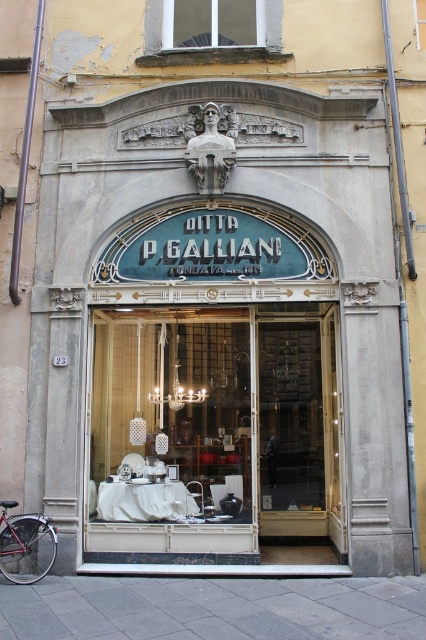
You are a delivery person arriving at the shop entrance. You need to locate the matte glass door at center to deliver a package. Based on the scene description, where should you look relative to the shiny red bicycle at lower left?

The matte glass door at center is to the right of the shiny red bicycle at lower left, so you should look to the right side of the shiny red bicycle at lower left to find the door.

You are standing at the entrance of P. Galliani shop and want to reach the two points marked on the shop facade. Which point, point [187,32] or point [2,531], is closer to you?

Point [187,32] is closer to you because it is further to the viewer than point [2,531].

Based on the photo, you are standing at the point labeled point (181, 3). You want to move to the other point, which is 12.18 meters away. Is there enough space for you to walk straight to that point without any obstacles?

The two points are 12.18 meters apart, so there is enough space to walk straight to the other point without any obstacles.